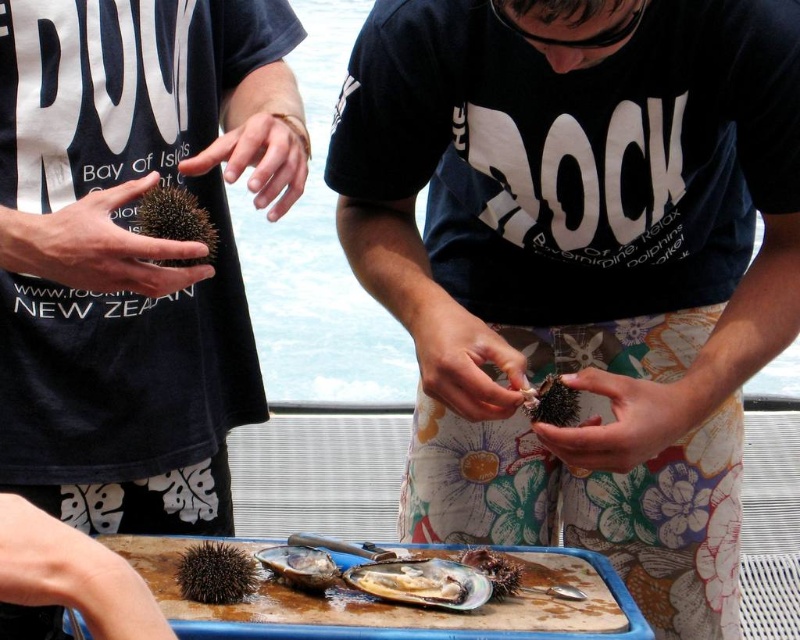
Is matte black hedgehog at center to the right of spiky brown sea urchin at center from the viewer's perspective?

Yes, matte black hedgehog at center is to the right of spiky brown sea urchin at center.

Can you confirm if matte black hedgehog at center is taller than spiky brown sea urchin at center?

Indeed, matte black hedgehog at center has a greater height compared to spiky brown sea urchin at center.

Does point (754, 272) come farther from viewer compared to point (570, 417)?

Yes.

This screenshot has height=640, width=800. Identify the location of matte black hedgehog at center. point(580,266).

Who is higher up, matte black hedgehog at left or spiky brown sea urchin at center?

matte black hedgehog at left is higher up.

Who is more distant from viewer, (x=297, y=116) or (x=576, y=403)?

Positioned behind is point (x=576, y=403).

I want to click on matte black hedgehog at left, so click(x=134, y=250).

Is matte black hedgehog at center bigger than brown spiny at left?

Yes, matte black hedgehog at center is bigger than brown spiny at left.

Is the position of matte black hedgehog at center more distant than that of brown spiny at left?

No.

Between point (534, 132) and point (136, 205), which one is positioned in front?

Positioned in front is point (136, 205).

The height and width of the screenshot is (640, 800). In order to click on matte black hedgehog at center in this screenshot , I will do `click(580, 266)`.